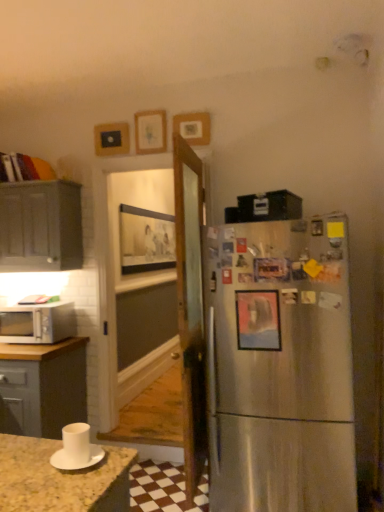
Question: From the image's perspective, relative to metallic silver picture frame at right, the fifth picture frame positioned from the back, is wooden picture frame at upper center, the fourth picture frame in the back-to-front sequence, above or below?

Choices:
 (A) below
 (B) above

Answer: (B)

Question: Is wooden picture frame at upper center, the fourth picture frame in the back-to-front sequence, wider or thinner than metallic silver picture frame at right, the fifth picture frame positioned from the back?

Choices:
 (A) wide
 (B) thin

Answer: (A)

Question: Estimate the real-world distances between objects in this image. Which object is closer to the white matte saucer at lower left?

Choices:
 (A) metallic silver picture frame at right, positioned as the first picture frame in bottom-to-top order
 (B) wooden picture frame at upper center, the second picture frame positioned from the top
 (C) wooden picture frame at upper center, marked as the 3th picture frame in a front-to-back arrangement
 (D) white glossy microwave at left
 (E) matte gray cabinet at left

Answer: (A)

Question: Based on their relative distances, which object is farther from the wooden picture frame at center, the 4th picture frame in the top-to-bottom sequence?

Choices:
 (A) wooden picture frame at upper center, arranged as the third picture frame when viewed from the back
 (B) matte gray cabinet at left
 (C) metallic rectangular frame at upper center, positioned as the 2th picture frame in back-to-front order
 (D) metallic silver picture frame at right, which is the first picture frame in front-to-back order
 (E) white matte saucer at lower left

Answer: (E)